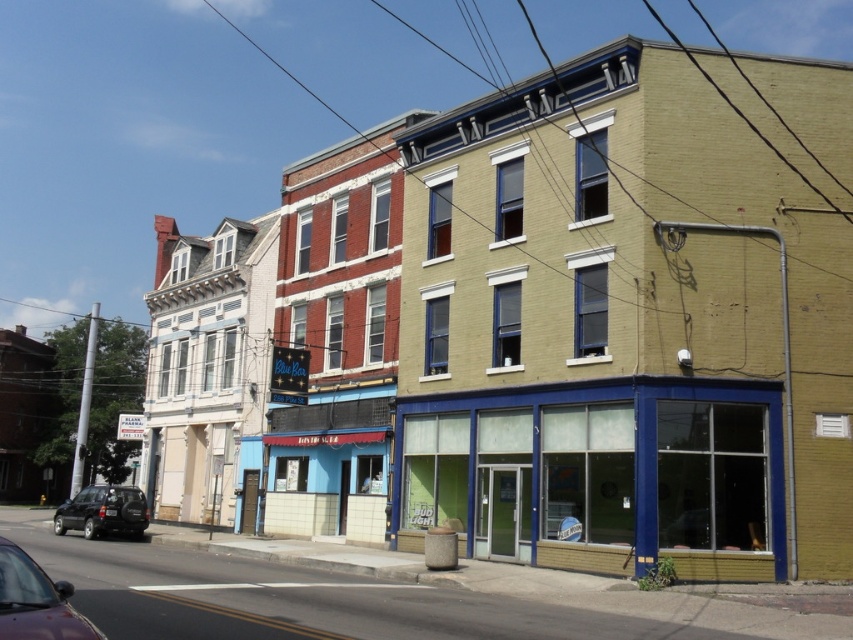
Question: Which object is the closest to the matte blue storefront at lower right?

Choices:
 (A) yellow brick building at center
 (B) shiny maroon sedan at lower left

Answer: (A)

Question: Which of the following is the farthest from the observer?

Choices:
 (A) matte blue storefront at lower right
 (B) yellow brick building at center

Answer: (A)

Question: Which object is closer to the camera taking this photo?

Choices:
 (A) shiny black suv at lower left
 (B) shiny maroon sedan at lower left

Answer: (B)

Question: Is matte blue storefront at lower right positioned in front of shiny black suv at lower left?

Choices:
 (A) yes
 (B) no

Answer: (A)

Question: Is shiny maroon sedan at lower left thinner than shiny black suv at lower left?

Choices:
 (A) no
 (B) yes

Answer: (B)

Question: Does yellow brick building at center have a smaller size compared to shiny black suv at lower left?

Choices:
 (A) yes
 (B) no

Answer: (A)